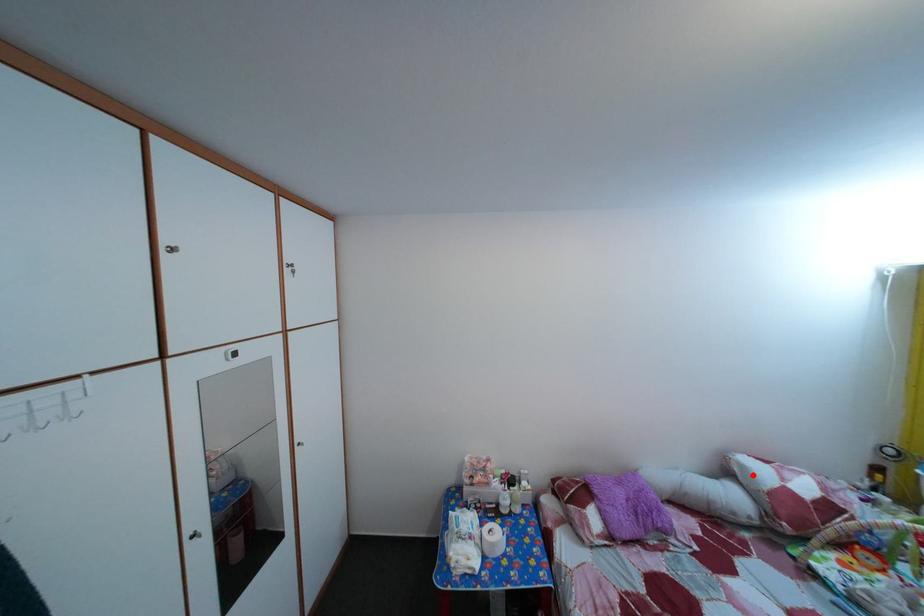
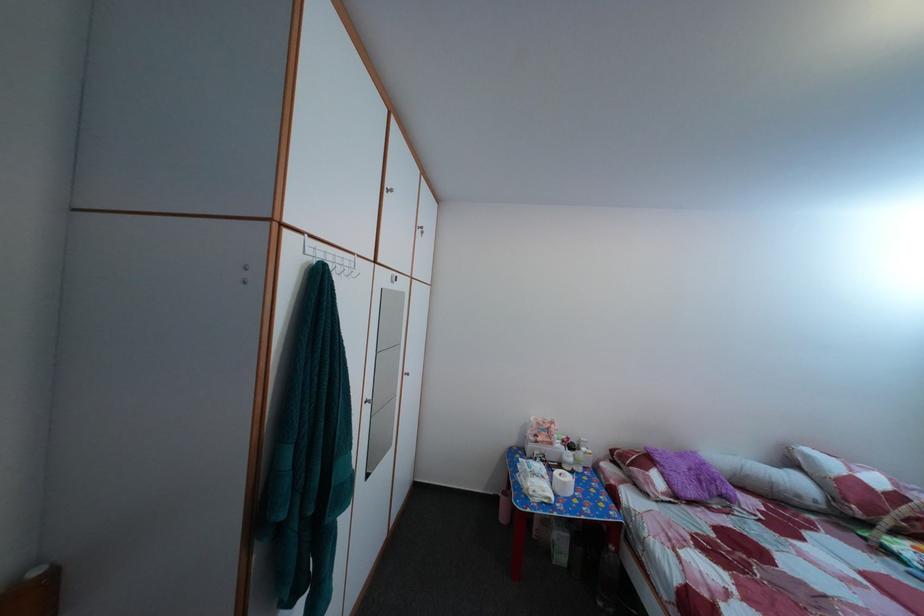
Where in the second image is the point corresponding to the highlighted location from the first image?

(817, 464)